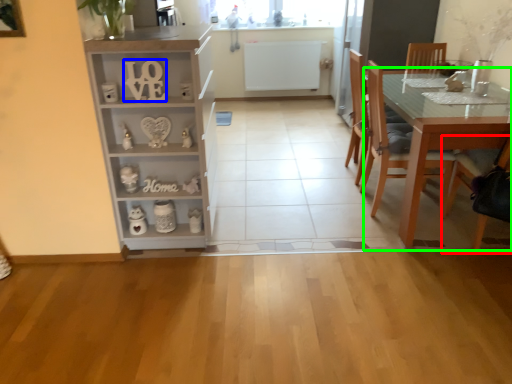
Question: Which is nearer to the chair (highlighted by a red box)? number (highlighted by a blue box) or table (highlighted by a green box).

Choices:
 (A) number
 (B) table

Answer: (B)